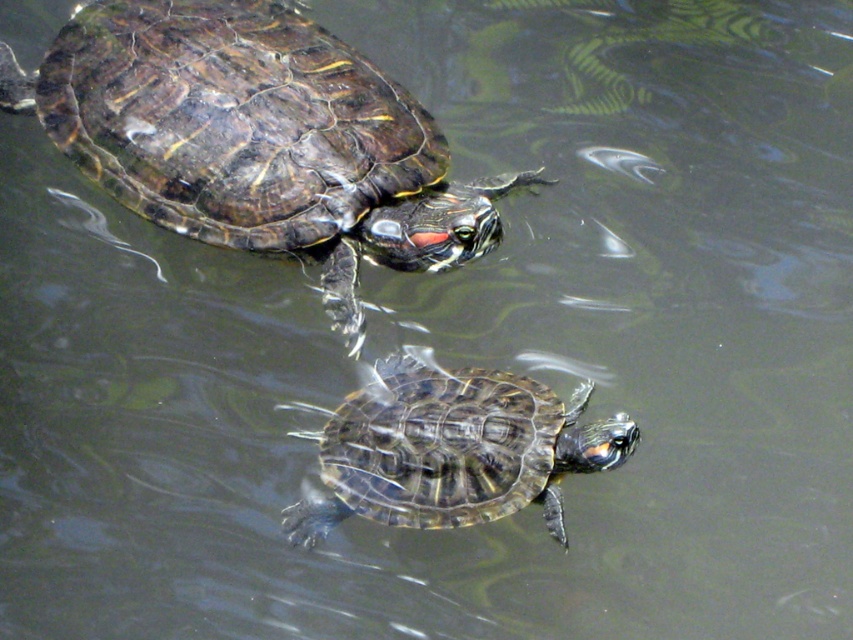
You are a marine biologist observing two turtles in a water tank. You need to determine which turtle is taller between the shiny dark green tortoise at upper left and the shiny brown tortoise at center. Based on their positions in the tank, can you identify which one is taller?

The shiny dark green tortoise at upper left is taller than the shiny brown tortoise at center according to the description.

You are a marine biologist observing two turtles in a water tank. You notice the shiny dark green tortoise at upper left and the shiny brown tortoise at center. Which turtle would cast a larger shadow if the light source is directly above them?

The shiny dark green tortoise at upper left is bigger than the shiny brown tortoise at center, so it would cast a larger shadow.

In the scene shown: You are standing at a distance of 5 feet from the water surface. You want to observe the point at coordinates point (258, 156). Is the point closer to you than your standing position?

The distance of point (258, 156) from viewer is 4.37 feet, which is less than 5 feet. Therefore, the point is closer to you than your standing position.